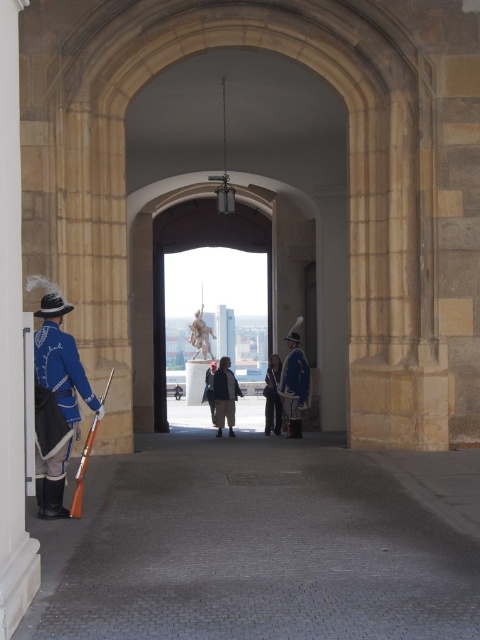
Question: From the image, what is the correct spatial relationship of blue fabric uniform at center in relation to blue fabric coat at center?

Choices:
 (A) above
 (B) below

Answer: (A)

Question: Which is farther from the blue matte uniform at left?

Choices:
 (A) blue fabric uniform at center
 (B) light brown leather jacket at center

Answer: (B)

Question: Which of these objects is positioned closest to the light brown leather jacket at center?

Choices:
 (A) blue fabric coat at center
 (B) blue fabric uniform at center

Answer: (A)

Question: Which object is closer to the camera taking this photo?

Choices:
 (A) blue fabric uniform at center
 (B) blue fabric coat at center

Answer: (A)

Question: Can you confirm if blue fabric uniform at center is positioned below light brown leather jacket at center?

Choices:
 (A) yes
 (B) no

Answer: (B)

Question: Can you confirm if blue fabric uniform at center is bigger than light brown leather jacket at center?

Choices:
 (A) yes
 (B) no

Answer: (B)